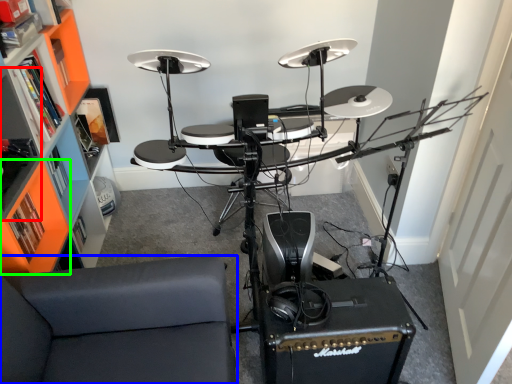
Question: Which object is positioned farthest from shelf (highlighted by a red box)? Select from furniture (highlighted by a blue box) and shelf (highlighted by a green box).

Choices:
 (A) furniture
 (B) shelf

Answer: (A)